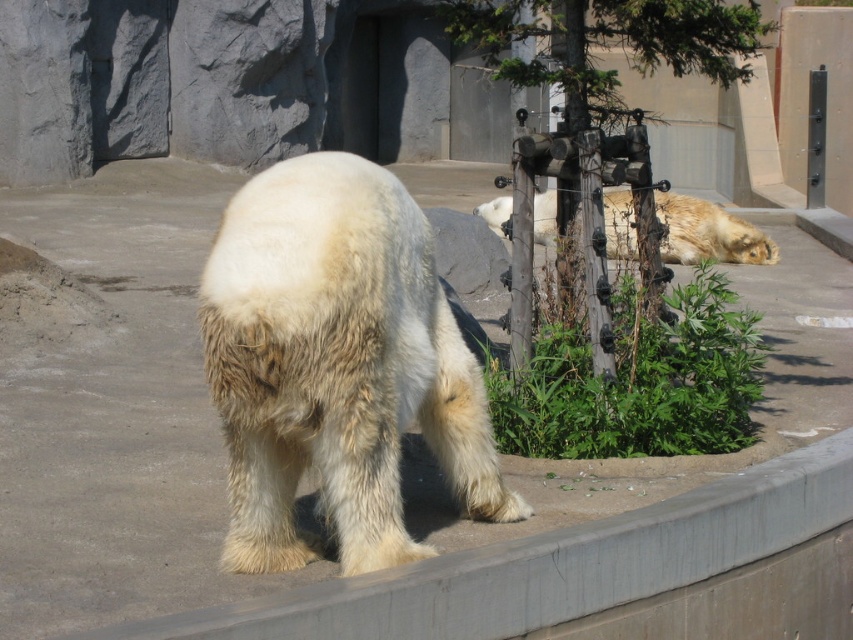
You are a visitor at the zoo and want to take a photo of both points in the enclosure. Which point, point (279, 509) or point (541, 204), is closer to you?

Point (279, 509) is closer to the viewer than point (541, 204).

You are a zookeeper who needs to place a new feeding tray on the gray concrete ledge at lower center so it won t be knocked over by the fuzzy golden bear at center. Considering their sizes, will the ledge be able to hold the feeding tray without it being easily tipped over?

The gray concrete ledge at lower center has a larger size compared to the fuzzy golden bear at center, so placing the feeding tray there should provide enough stability and space to prevent it from being easily tipped over by the bear.

You are a zookeeper standing at the entrance of the polar bear enclosure. You notice two points marked in the image. The first point is at coordinates point (335, 604) and the second is at point (625, 195). Which of these points is closer to you, the zookeeper?

Point (335, 604) is in front of point (625, 195), so the first point is closer to you.